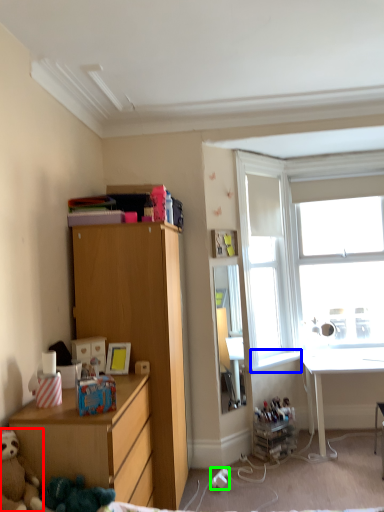
Question: Estimate the real-world distances between objects in this image. Which object is farther from teddy bear (highlighted by a red box), window sill (highlighted by a blue box) or power outlet (highlighted by a green box)?

Choices:
 (A) window sill
 (B) power outlet

Answer: (A)